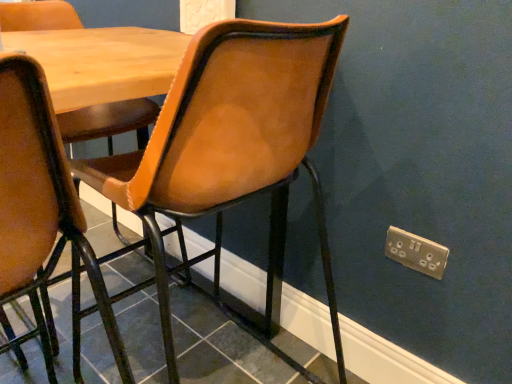
Question: Is matte black tile at lower center in front of or behind leather-like brown chair at center in the image?

Choices:
 (A) behind
 (B) front

Answer: (A)

Question: In terms of width, does matte black tile at lower center look wider or thinner when compared to leather-like brown chair at center?

Choices:
 (A) thin
 (B) wide

Answer: (B)

Question: Considering the real-world distances, which object is closest to the matte black tile at lower center?

Choices:
 (A) leather-like brown chair at center
 (B) gold metallic electric outlet at lower right
 (C) wooden table at center

Answer: (A)

Question: Which object is positioned farthest from the matte black tile at lower center?

Choices:
 (A) wooden table at center
 (B) gold metallic electric outlet at lower right
 (C) leather-like brown chair at center

Answer: (A)